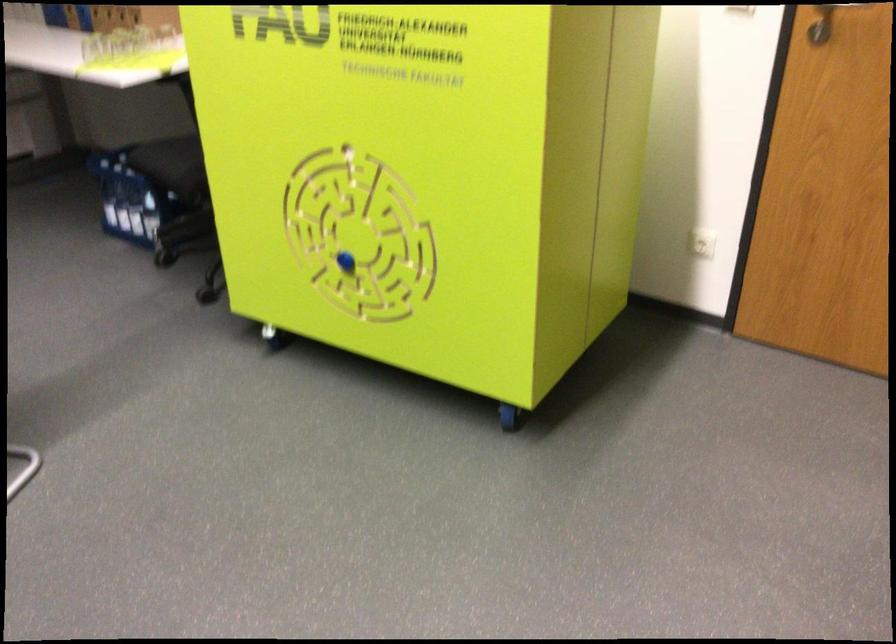
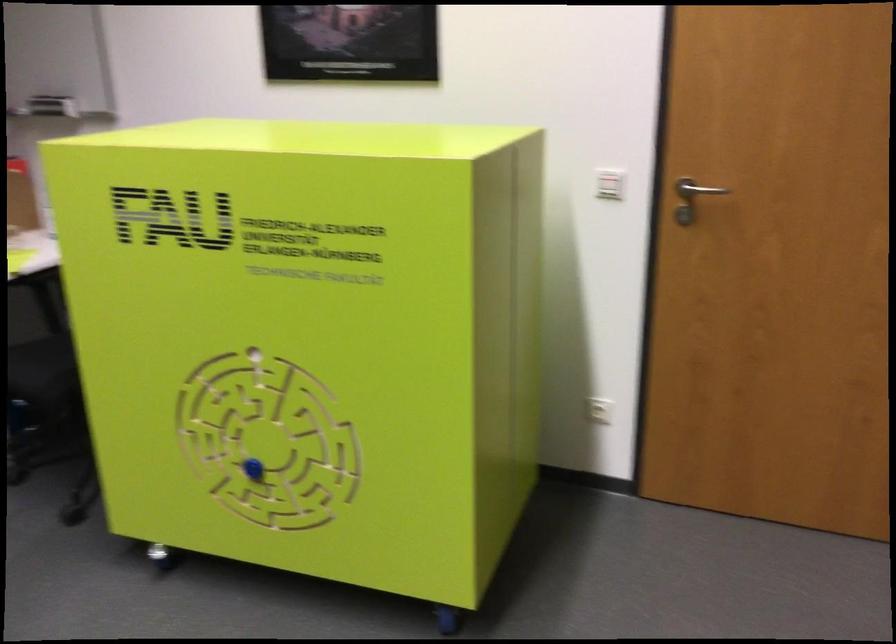
Find the pixel in the second image that matches (342,261) in the first image.

(253, 469)